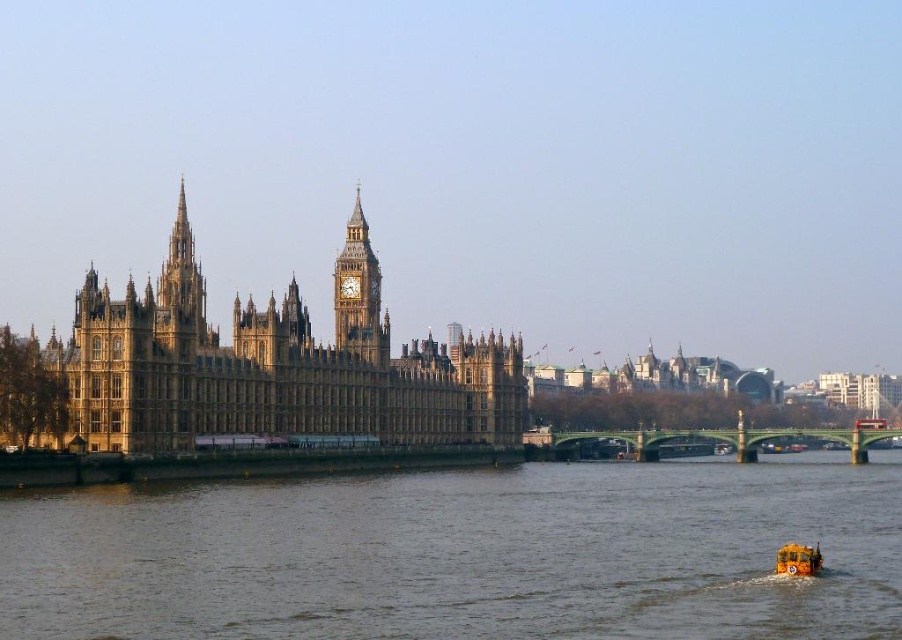
You are standing at the point with coordinates point (802, 563) and want to walk to the point with coordinates point (164, 275). Based on the scene description, which direction should you face to walk towards your destination?

Since point (164, 275) is behind point (802, 563), you should face away from the direction of the Palace of Westminster to walk towards point (164, 275).